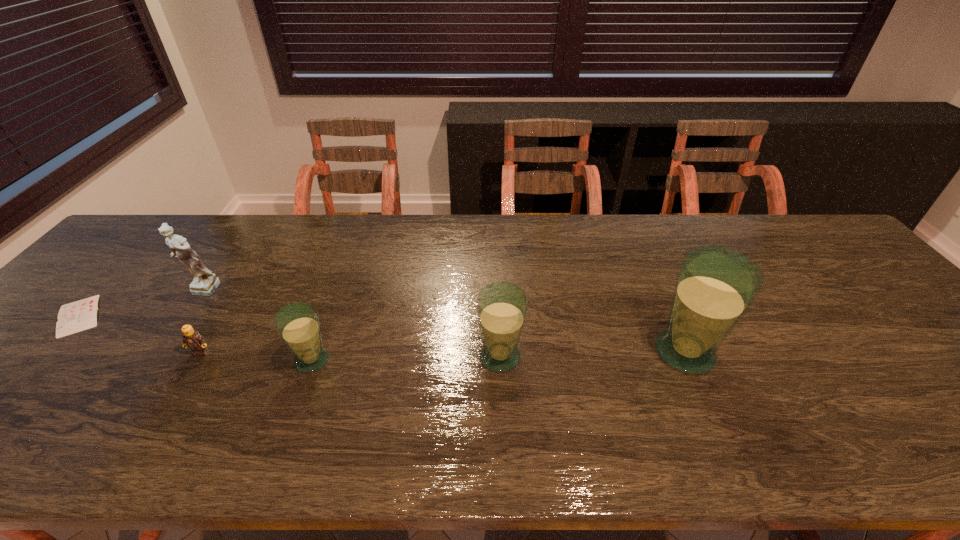
Where is `the fourth object from right to left`? The image size is (960, 540). the fourth object from right to left is located at coordinates (192, 339).

Where is `Lego`? The height and width of the screenshot is (540, 960). Lego is located at coordinates (192, 339).

At what (x,y) coordinates should I click in order to perform the action: click on blank space located on the right of the shortest glass. Please return your answer as a coordinate pair (x, y). This screenshot has height=540, width=960. Looking at the image, I should click on (425, 360).

This screenshot has height=540, width=960. I want to click on free location located on the left of the third tallest object, so click(349, 356).

Locate an element on the screen. free spot located 0.130m on the left of the rightmost object is located at coordinates (597, 353).

Identify the location of vacant space located 0.260m on the front-facing side of the fifth shortest object. This screenshot has width=960, height=540. (136, 384).

Identify the location of free space located on the back of the shortest object. (110, 282).

Locate an element on the screen. free space located 0.150m in front of the Lego is located at coordinates (165, 413).

Identify the location of object located in the left edge section of the desktop. (74, 317).

Find the location of a particular element. The width and height of the screenshot is (960, 540). blank space at the far edge of the desktop is located at coordinates (753, 213).